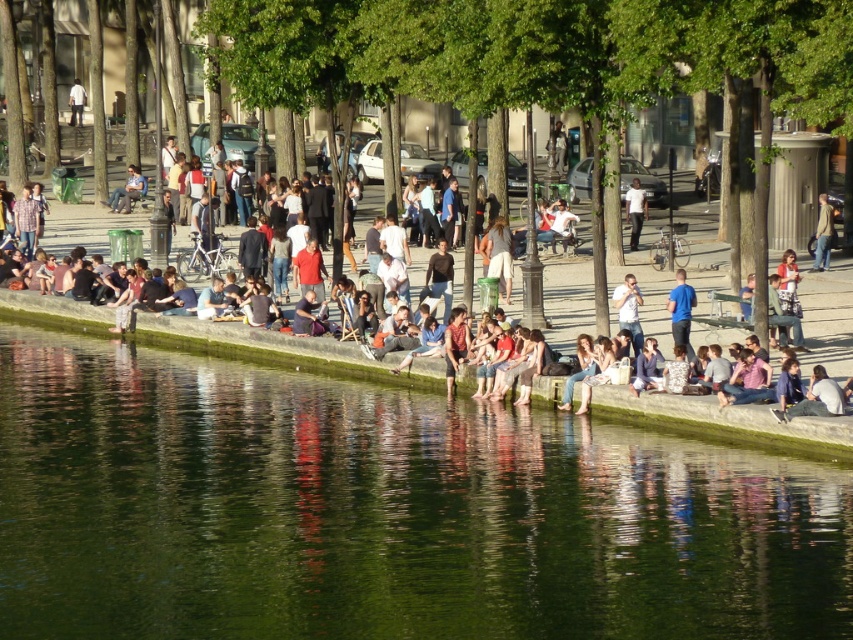
Question: Does green smooth water at center have a smaller size compared to light brown leather jacket at center?

Choices:
 (A) yes
 (B) no

Answer: (B)

Question: Which object is closer to the camera taking this photo?

Choices:
 (A) green smooth water at center
 (B) blue cotton shirt at center
 (C) white cotton shirt at upper left
 (D) light blue denim jeans at lower right

Answer: (A)

Question: Which object appears closest to the camera in this image?

Choices:
 (A) matte black shirt at center
 (B) white matte shirt at center
 (C) light brown leather jacket at center

Answer: (A)

Question: Does blue cotton shirt at center lie in front of matte black jacket at center?

Choices:
 (A) no
 (B) yes

Answer: (B)

Question: Which of these objects is positioned closest to the white cotton shirt at upper left?

Choices:
 (A) white matte shirt at center
 (B) green smooth water at center

Answer: (A)

Question: Can you confirm if light brown leather jacket at center is positioned to the left of white cotton shirt at upper left?

Choices:
 (A) yes
 (B) no

Answer: (B)